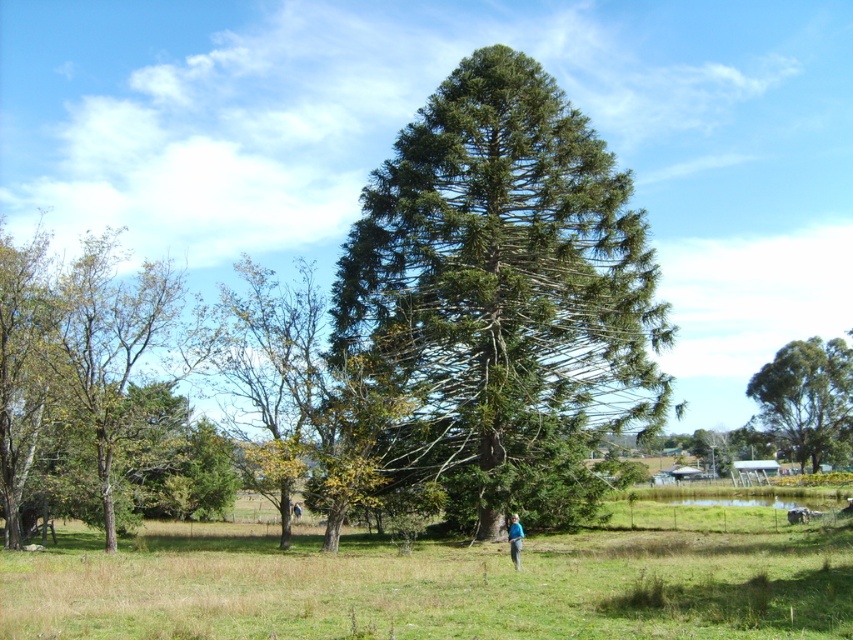
Does green leafy grass at center appear under green leafy tree at right?

Yes, green leafy grass at center is below green leafy tree at right.

In the scene shown: Measure the distance from green leafy grass at center to green leafy tree at right.

green leafy grass at center and green leafy tree at right are 53.95 meters apart from each other.

Is point (817, 552) positioned behind point (827, 424)?

No, it is in front of (827, 424).

The height and width of the screenshot is (640, 853). I want to click on green leafy grass at center, so click(x=448, y=580).

Which is more to the left, green leafy grass at center or blue fabric shirt at lower center?

green leafy grass at center is more to the left.

Which is behind, point (674, 513) or point (515, 568)?

Point (674, 513)

Find the location of `green leafy grass at center`. green leafy grass at center is located at coordinates (448, 580).

You are a GUI agent. You are given a task and a screenshot of the screen. Output one action in this format:
    pyautogui.click(x=<x>, y=<y>)
    Task: Click on the green leafy grass at center
    This screenshot has height=640, width=853.
    Given the screenshot: What is the action you would take?
    pyautogui.click(x=448, y=580)

Does point (149, 451) lie in front of point (291, 508)?

Yes, point (149, 451) is closer to viewer.

Between point (122, 502) and point (297, 509), which one is positioned behind?

Positioned behind is point (297, 509).

Which is behind, point (49, 282) or point (300, 509)?

The point (300, 509) is behind.

Locate an element on the screen. The width and height of the screenshot is (853, 640). green leafy tree at left is located at coordinates (100, 388).